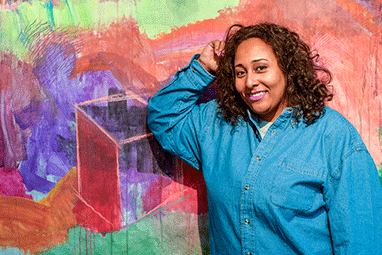
This screenshot has width=382, height=255. Identify the location of red and purple cube painted on wall. (111, 158), (135, 146), (136, 115).